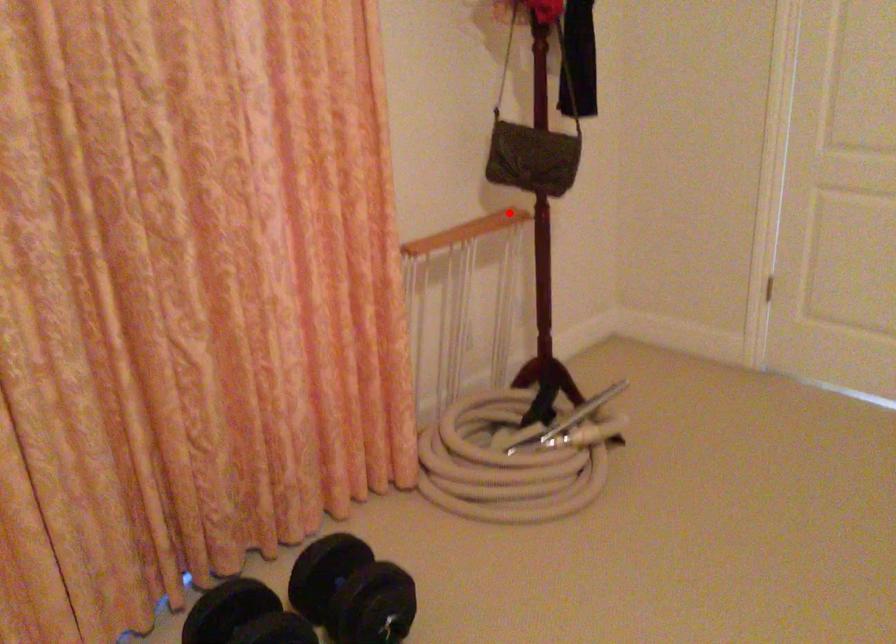
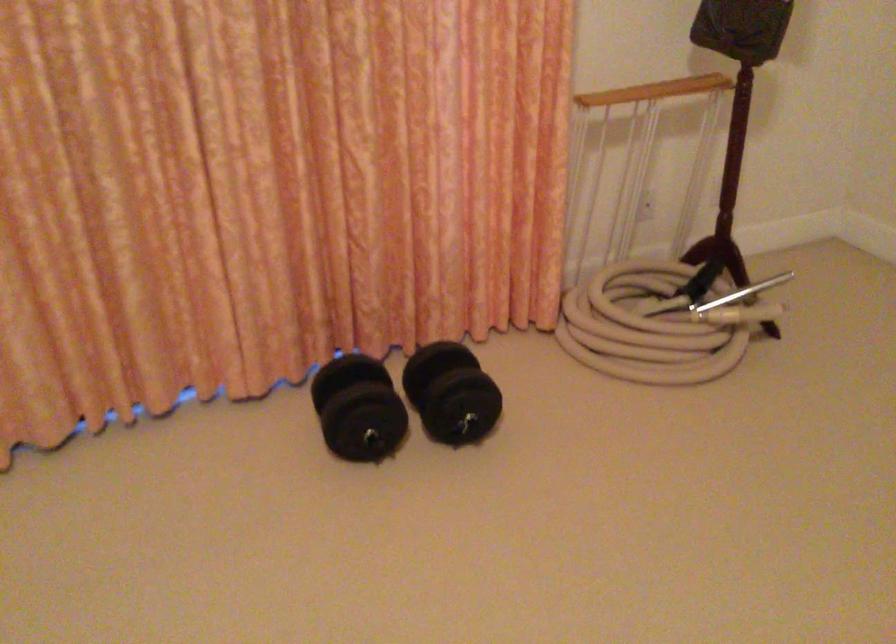
In the second image, find the point that corresponds to the highlighted location in the first image.

(711, 78)